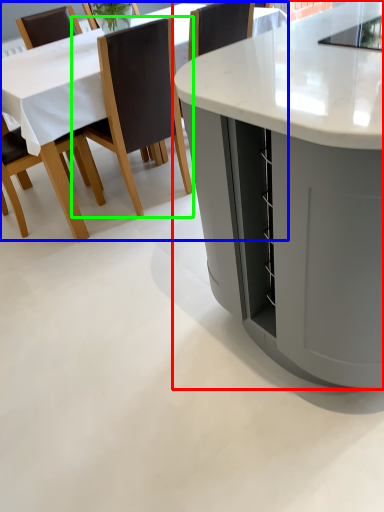
Question: Based on their relative distances, which object is farther from table (highlighted by a red box)? Choose from table (highlighted by a blue box) and chair (highlighted by a green box).

Choices:
 (A) table
 (B) chair

Answer: (A)